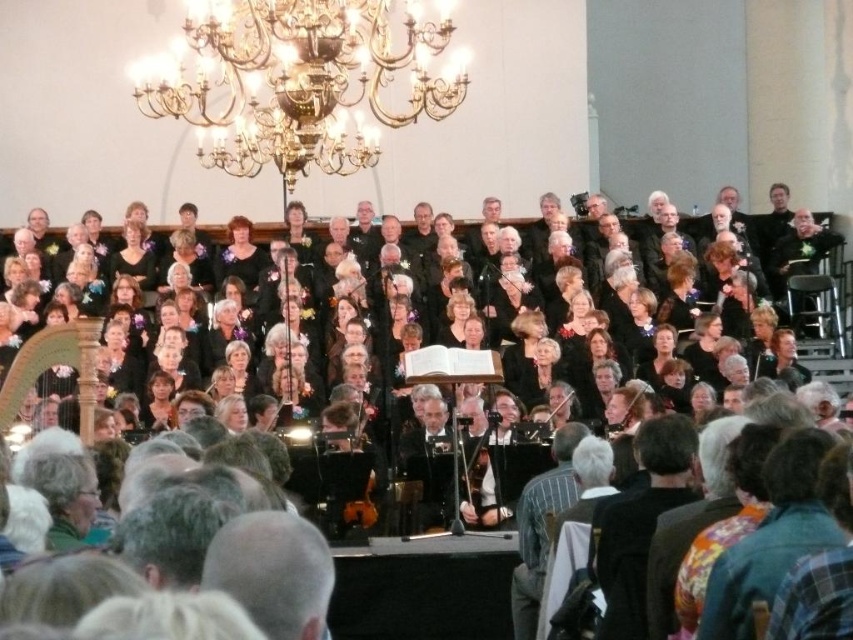
You are a stagehand who needs to adjust the lighting for the next performance. You notice the gold crystal chandelier at upper center and the black leather jacket at upper center on stage. Which object is positioned higher above the stage floor?

The gold crystal chandelier at upper center is much taller than the black leather jacket at upper center, so it is positioned higher above the stage floor.

You are an event planner setting up a new spotlight for the stage. The spotlight needs to be placed directly to the right of the gold crystal chandelier at upper center. According to the stage layout, can you confirm the position where the spotlight should be placed?

The gold crystal chandelier at upper center is located at point (297, 81). Therefore, the spotlight should be placed to the right of this coordinate, specifically at a position with a higher x value than 0.127 while maintaining the same y coordinate of 0.349.